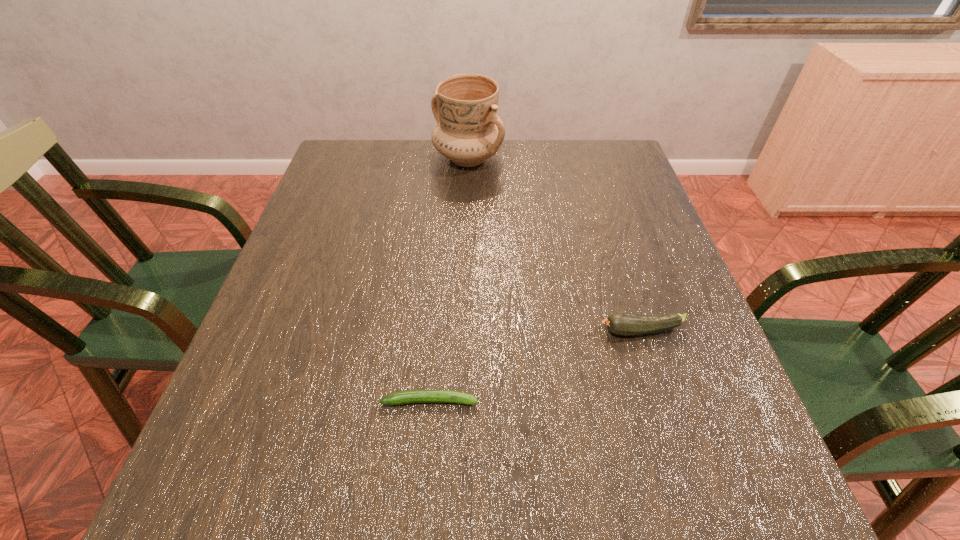
Where is `the farthest object`? the farthest object is located at coordinates (469, 131).

Where is `the tallest object`? This screenshot has width=960, height=540. the tallest object is located at coordinates (469, 131).

Image resolution: width=960 pixels, height=540 pixels. I want to click on the right zucchini, so click(625, 324).

Where is `the farther zucchini`? the farther zucchini is located at coordinates (625, 324).

Locate an element on the screen. The width and height of the screenshot is (960, 540). the shortest object is located at coordinates (430, 395).

Where is `the nearer zucchini`? the nearer zucchini is located at coordinates (430, 395).

Identify the location of vacant space located 0.290m on the right of the pottery. This screenshot has width=960, height=540. (601, 159).

At what (x,y) coordinates should I click in order to perform the action: click on vacant region located 0.380m at the blossom end of the farther zucchini. Please return your answer as a coordinate pair (x, y). Looking at the image, I should click on point(403,331).

At what (x,y) coordinates should I click in order to perform the action: click on blank space located 0.400m at the blossom end of the farther zucchini. Please return your answer as a coordinate pair (x, y). Looking at the image, I should click on pos(393,331).

This screenshot has height=540, width=960. I want to click on free point located at the blossom end of the farther zucchini, so click(428, 331).